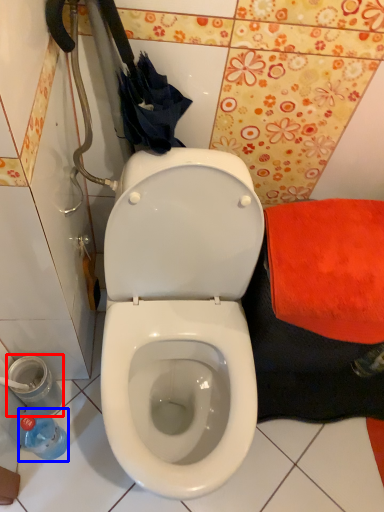
Question: Which of the following is the closest to the observer, potty (highlighted by a red box) or bottle (highlighted by a blue box)?

Choices:
 (A) potty
 (B) bottle

Answer: (B)